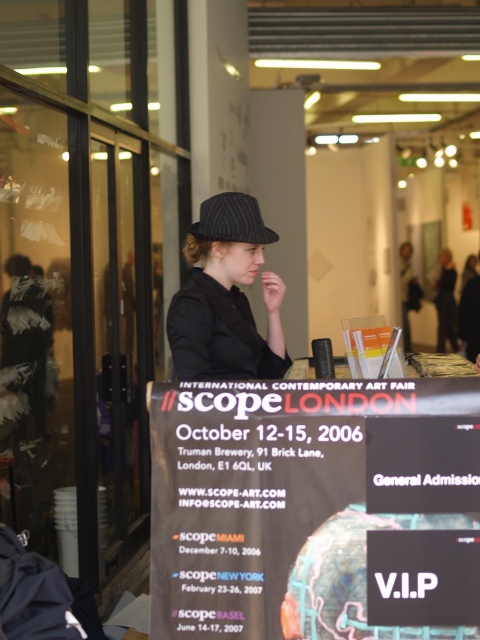
Which is more to the left, matte black hat at center or dark blue pinstripe baseball hat at center?

matte black hat at center is more to the left.

The width and height of the screenshot is (480, 640). Describe the element at coordinates (226, 298) in the screenshot. I see `matte black hat at center` at that location.

Is point (216, 221) closer to viewer compared to point (247, 228)?

Yes.

I want to click on matte black hat at center, so click(226, 298).